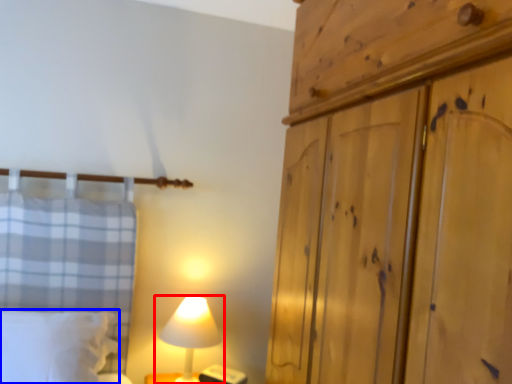
Question: Which point is closer to the camera, lamp (highlighted by a red box) or pillow (highlighted by a blue box)?

Choices:
 (A) lamp
 (B) pillow

Answer: (B)